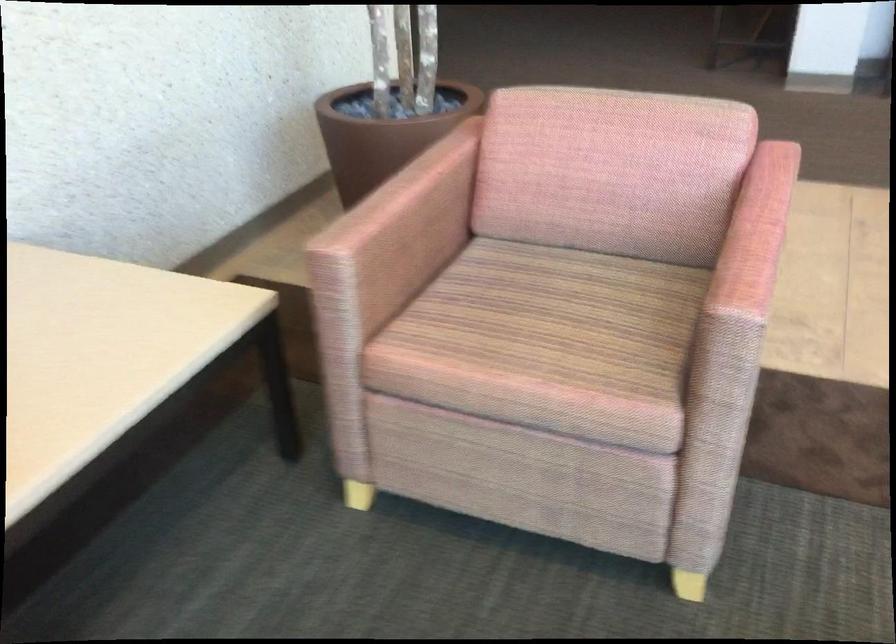
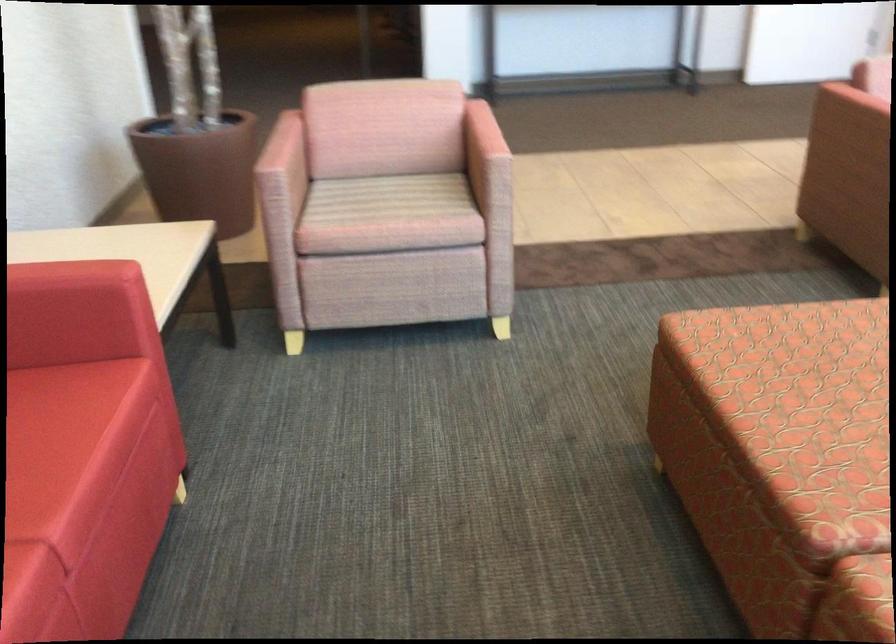
Locate, in the second image, the point that corresponds to pixel 733 245 in the first image.

(481, 133)